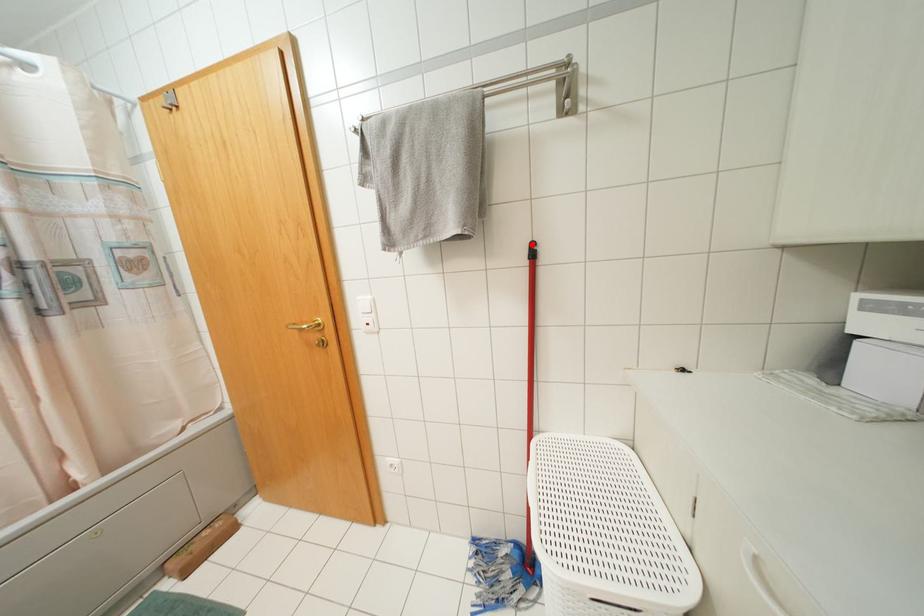
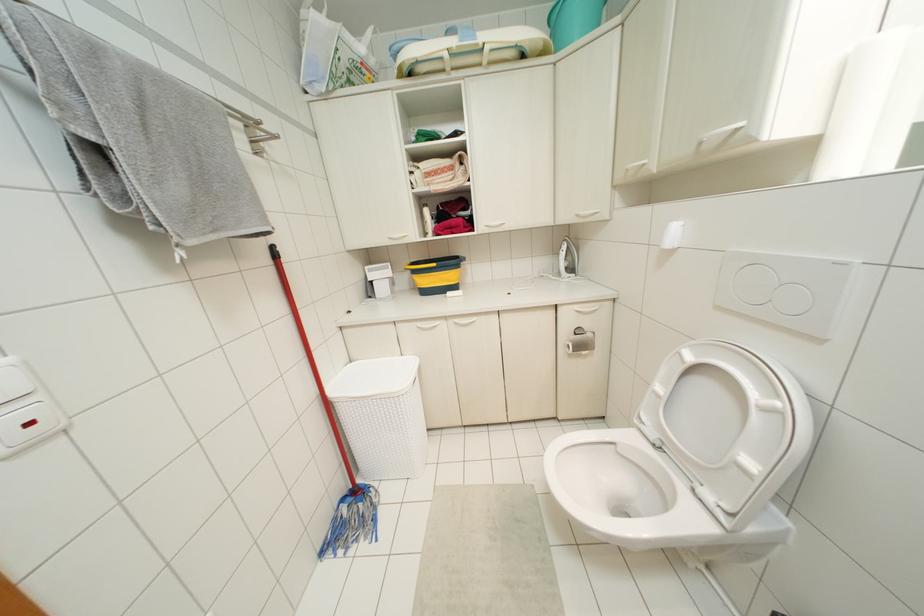
Question: I am providing you with two images of the same scene from different viewpoints. A red point is marked on the first image. Is the red point's position out of view in image 2?

Choices:
 (A) Yes
 (B) No

Answer: (B)